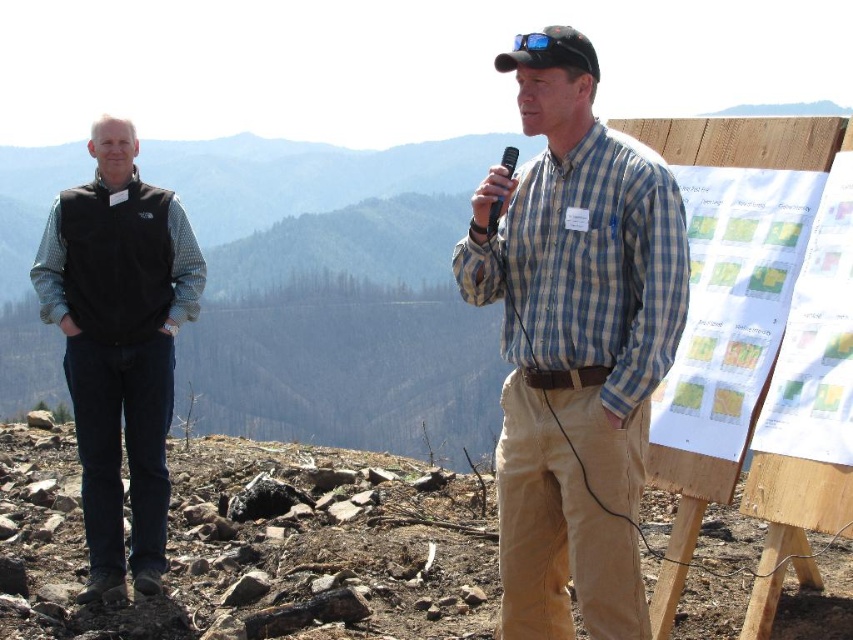
You are a photographer trying to capture both the blue plaid shirt at center and the black fleece vest at left in a single shot. Which clothing item will appear larger in your photo?

The blue plaid shirt at center will appear larger in the photo because it is closer to the viewer compared to the black fleece vest at left.

You are a photographer aiming to capture both the blue plaid shirt at center and the black fleece vest at left in a single frame. Based on their positions, which one would appear closer to the camera in the photo?

The blue plaid shirt at center is located above the black fleece vest at left, so in the photo, the black fleece vest at left would appear closer to the camera because it is positioned lower in the frame.